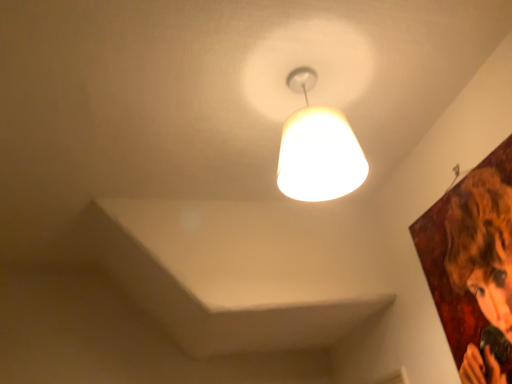
Question: Considering the positions of smooth brown hair at upper right and matte white lampshade at upper center in the image, is smooth brown hair at upper right wider or thinner than matte white lampshade at upper center?

Choices:
 (A) thin
 (B) wide

Answer: (A)

Question: Would you say smooth brown hair at upper right is to the left or to the right of matte white lampshade at upper center in the picture?

Choices:
 (A) left
 (B) right

Answer: (B)

Question: Considering their positions, is smooth brown hair at upper right located in front of or behind matte white lampshade at upper center?

Choices:
 (A) behind
 (B) front

Answer: (B)

Question: From the image's perspective, relative to smooth brown hair at upper right, is matte white lampshade at upper center above or below?

Choices:
 (A) below
 (B) above

Answer: (B)

Question: From their relative heights in the image, would you say matte white lampshade at upper center is taller or shorter than smooth brown hair at upper right?

Choices:
 (A) short
 (B) tall

Answer: (A)

Question: From a real-world perspective, relative to smooth brown hair at upper right, is matte white lampshade at upper center vertically above or below?

Choices:
 (A) above
 (B) below

Answer: (A)

Question: Would you say matte white lampshade at upper center is inside or outside smooth brown hair at upper right?

Choices:
 (A) outside
 (B) inside

Answer: (A)